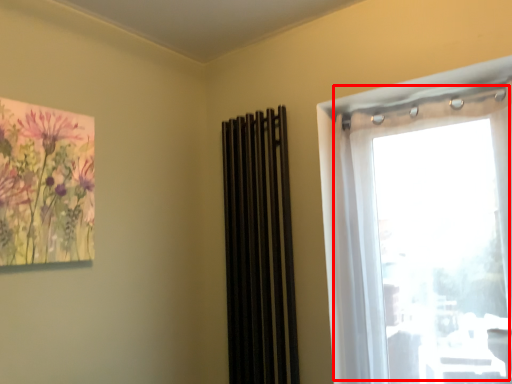
Question: From the image, what is the correct spatial relationship of window (annotated by the red box) in relation to curtain?

Choices:
 (A) right
 (B) left

Answer: (A)